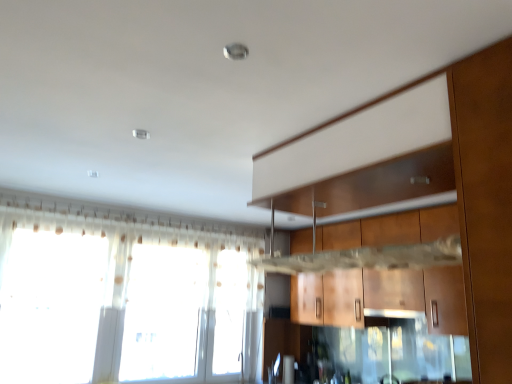
Question: Is point pos(373,309) closer or farther from the camera than point pos(444,220)?

Choices:
 (A) closer
 (B) farther

Answer: (B)

Question: Looking at the image, does matte white exhaust hood at center seem bigger or smaller compared to wooden cabinet at center?

Choices:
 (A) big
 (B) small

Answer: (B)

Question: Which of these objects is positioned farthest from the wooden cabinet at center?

Choices:
 (A) translucent fabric window at lower left
 (B) matte white exhaust hood at center

Answer: (A)

Question: Which object is positioned farthest from the translucent fabric window at lower left?

Choices:
 (A) wooden cabinet at center
 (B) matte white exhaust hood at center

Answer: (B)